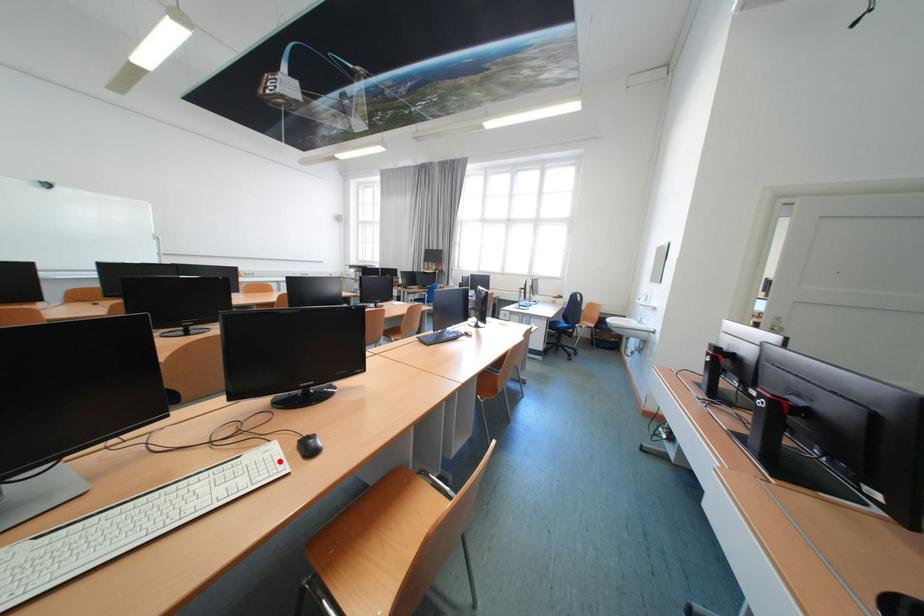
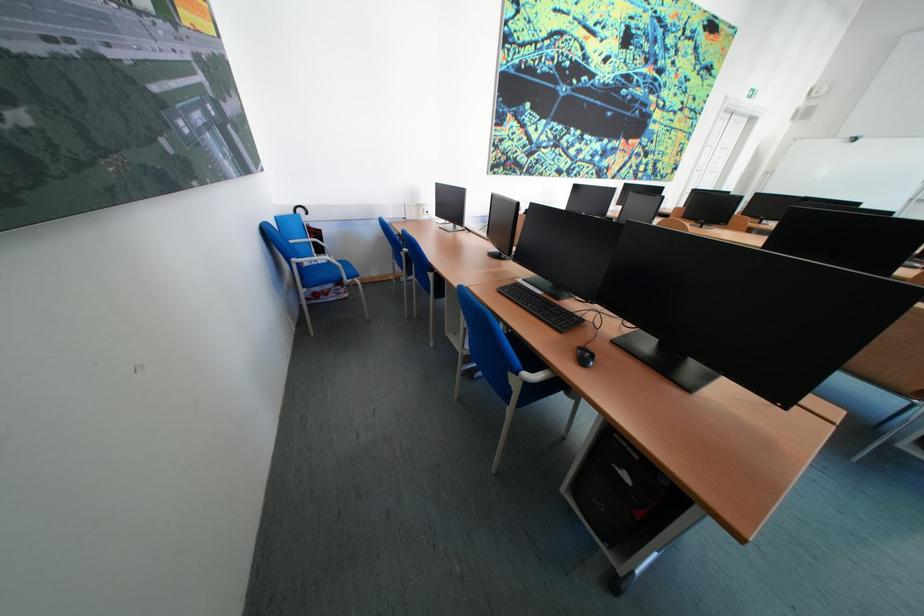
Question: I am providing you with two images of the same scene from different viewpoints. A red point is marked on the first image. Can you still see the location of the red point in image 2?

Choices:
 (A) Yes
 (B) No

Answer: (B)